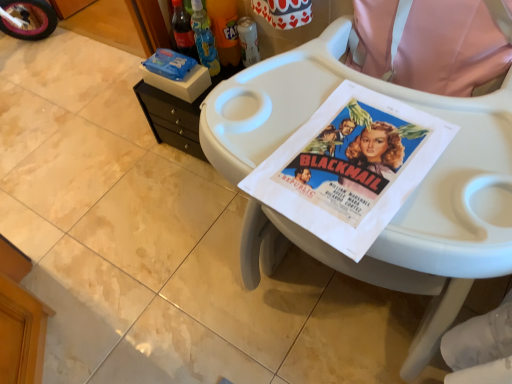
Question: Can you confirm if translucent plastic bottle at upper center, the 2th bottle positioned from the left, is positioned to the left of black plastic changing table at upper left?

Choices:
 (A) yes
 (B) no

Answer: (B)

Question: Does translucent plastic bottle at upper center, which appears as the second bottle when viewed from the right, have a lesser height compared to black plastic changing table at upper left?

Choices:
 (A) no
 (B) yes

Answer: (A)

Question: Considering the relative positions of translucent plastic bottle at upper center, the 2th bottle positioned from the left, and black plastic changing table at upper left in the image provided, is translucent plastic bottle at upper center, the 2th bottle positioned from the left, in front of black plastic changing table at upper left?

Choices:
 (A) yes
 (B) no

Answer: (A)

Question: Could you tell me if translucent plastic bottle at upper center, the 2th bottle positioned from the left, is facing black plastic changing table at upper left?

Choices:
 (A) no
 (B) yes

Answer: (A)

Question: From the image's perspective, would you say translucent plastic bottle at upper center, the 2th bottle positioned from the left, is positioned over black plastic changing table at upper left?

Choices:
 (A) yes
 (B) no

Answer: (A)

Question: Is translucent plastic bottle at upper center, which appears as the second bottle when viewed from the right, behind black plastic changing table at upper left?

Choices:
 (A) no
 (B) yes

Answer: (A)

Question: From a real-world perspective, is white glossy tile at lower left located higher than white plastic feeding chair at center?

Choices:
 (A) yes
 (B) no

Answer: (B)

Question: Is white glossy tile at lower left smaller than white plastic feeding chair at center?

Choices:
 (A) yes
 (B) no

Answer: (A)

Question: Does white glossy tile at lower left turn towards white plastic feeding chair at center?

Choices:
 (A) yes
 (B) no

Answer: (B)

Question: Does white glossy tile at lower left lie in front of white plastic feeding chair at center?

Choices:
 (A) yes
 (B) no

Answer: (B)

Question: Considering the relative positions of white glossy tile at lower left and white plastic feeding chair at center in the image provided, is white glossy tile at lower left behind white plastic feeding chair at center?

Choices:
 (A) no
 (B) yes

Answer: (B)

Question: Can you confirm if white glossy tile at lower left is taller than white plastic feeding chair at center?

Choices:
 (A) no
 (B) yes

Answer: (A)

Question: Is translucent plastic bottle at upper center, the 2th bottle positioned from the left, a part of black plastic changing table at upper left?

Choices:
 (A) yes
 (B) no

Answer: (B)